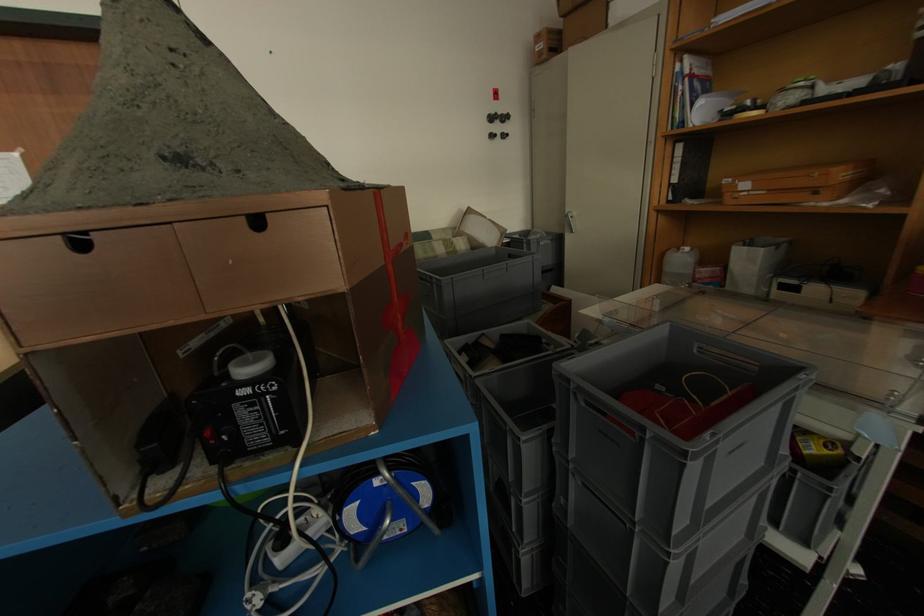
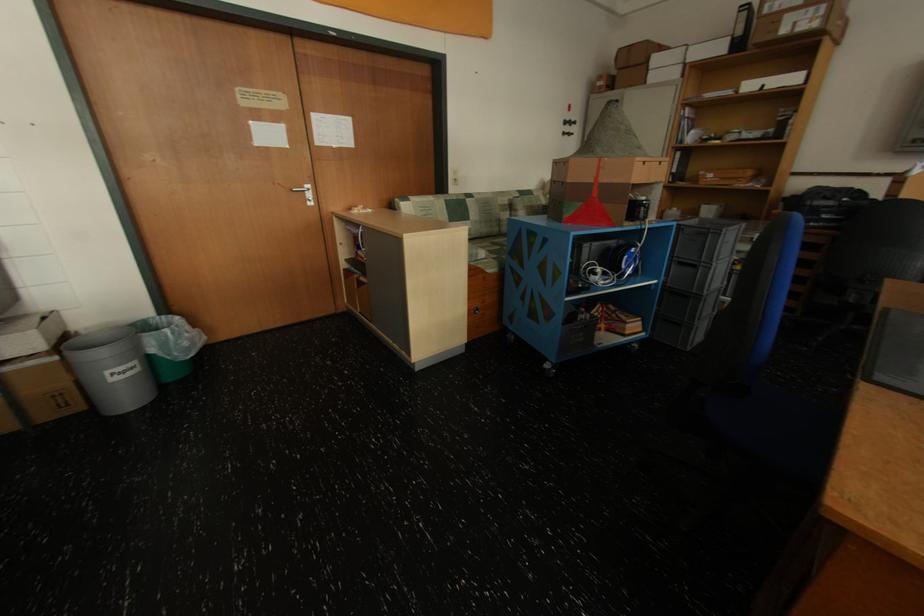
Locate, in the second image, the point that corresponds to point (754, 187) in the first image.

(719, 177)